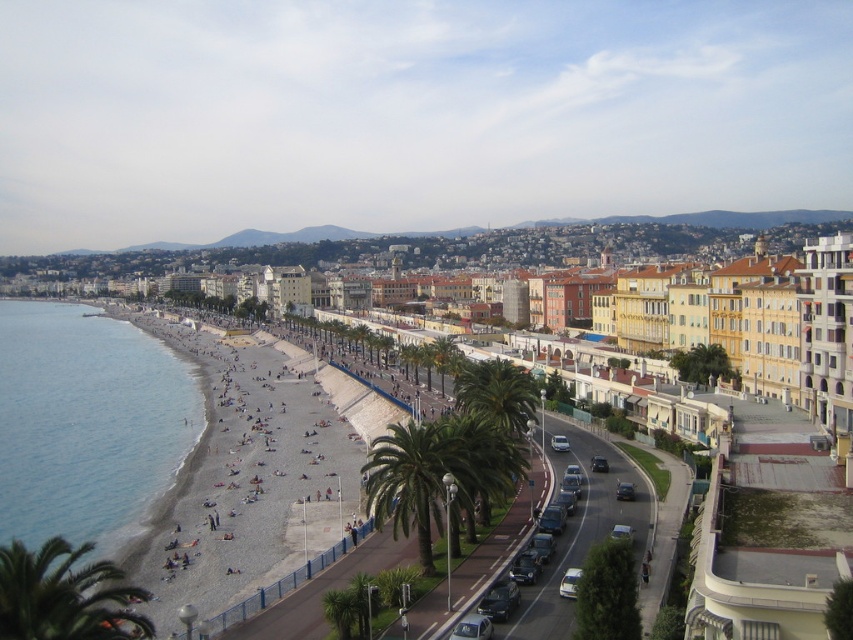
You are a photographer setting up a tripod to capture both the metallic silver car at center and the shiny black sedan at center. Which car should you position closer to the camera to ensure both are fully visible in the frame?

The metallic silver car at center is not as tall as the shiny black sedan at center. To ensure both are fully visible, position the metallic silver car closer to the camera so its smaller height doesn

You are standing on the beach and see the metallic silver car at center. If you walk straight towards the sea, will you pass by the car first before reaching the water?

The metallic silver car at center is located at point [473,627]. Since the beach is in the foreground and the car is at center, walking straight towards the sea would mean moving towards the water directly ahead, so you would not pass by the car first. The car is positioned centrally, so it would be to your side rather than directly in front. Therefore, you would reach the water before the car.